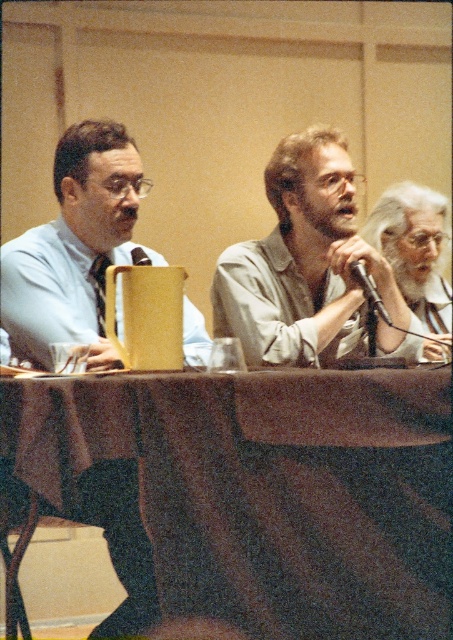
Between light gray shirt at center and yellow matte microphone at center, which one appears on the left side from the viewer's perspective?

yellow matte microphone at center is more to the left.

Between point (293, 193) and point (144, 259), which one is positioned in front?

Positioned in front is point (293, 193).

Does point (351, 246) come closer to viewer compared to point (145, 257)?

That is True.

At what (x,y) coordinates should I click in order to perform the action: click on light gray shirt at center. Please return your answer as a coordinate pair (x, y). Looking at the image, I should click on (303, 262).

Who is more distant from viewer, (409, 305) or (384, 307)?

The point (409, 305) is more distant.

Does white hair at upper right appear on the left side of metallic silver microphone at center?

No, white hair at upper right is not to the left of metallic silver microphone at center.

Which is behind, point (401, 292) or point (395, 326)?

The point (401, 292) is more distant.

Where is `white hair at upper right`? The image size is (453, 640). white hair at upper right is located at coordinates (415, 253).

Which of these two, brown fabric table at center or white hair at upper right, stands shorter?

white hair at upper right

Is brown fabric table at center further to the viewer compared to white hair at upper right?

No, it is in front of white hair at upper right.

This screenshot has height=640, width=453. What do you see at coordinates (258, 490) in the screenshot?
I see `brown fabric table at center` at bounding box center [258, 490].

Where is `brown fabric table at center`? This screenshot has width=453, height=640. brown fabric table at center is located at coordinates (258, 490).